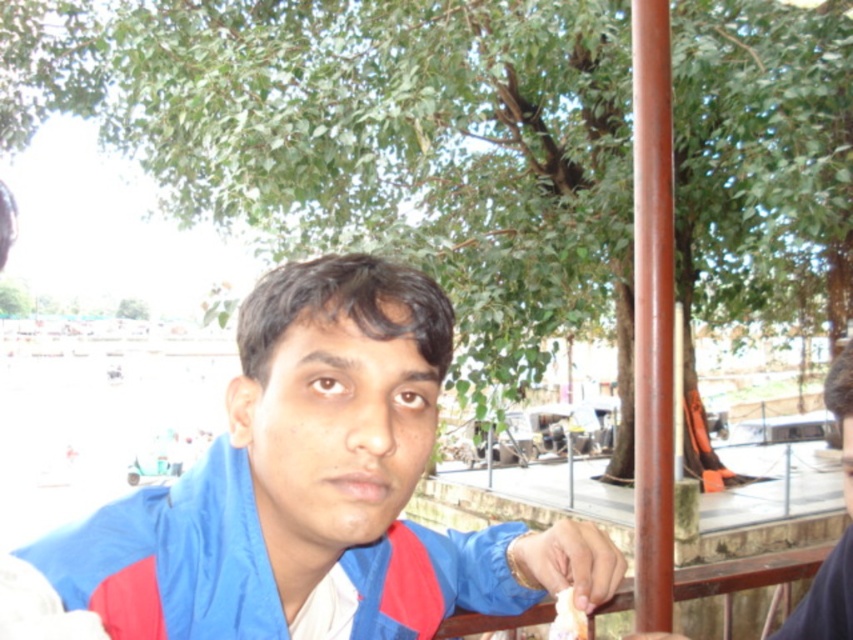
Question: From the image, what is the correct spatial relationship of blue fabric jacket at center in relation to white creamy food at lower center?

Choices:
 (A) left
 (B) right

Answer: (A)

Question: Among these points, which one is nearest to the camera?

Choices:
 (A) (306, 580)
 (B) (578, 627)

Answer: (A)

Question: Is blue fabric jacket at center further to the viewer compared to white creamy food at lower center?

Choices:
 (A) yes
 (B) no

Answer: (B)

Question: Observing the image, what is the correct spatial positioning of blue fabric jacket at center in reference to white creamy food at lower center?

Choices:
 (A) right
 (B) left

Answer: (B)

Question: Which of the following is the farthest from the observer?

Choices:
 (A) (573, 611)
 (B) (294, 266)

Answer: (A)